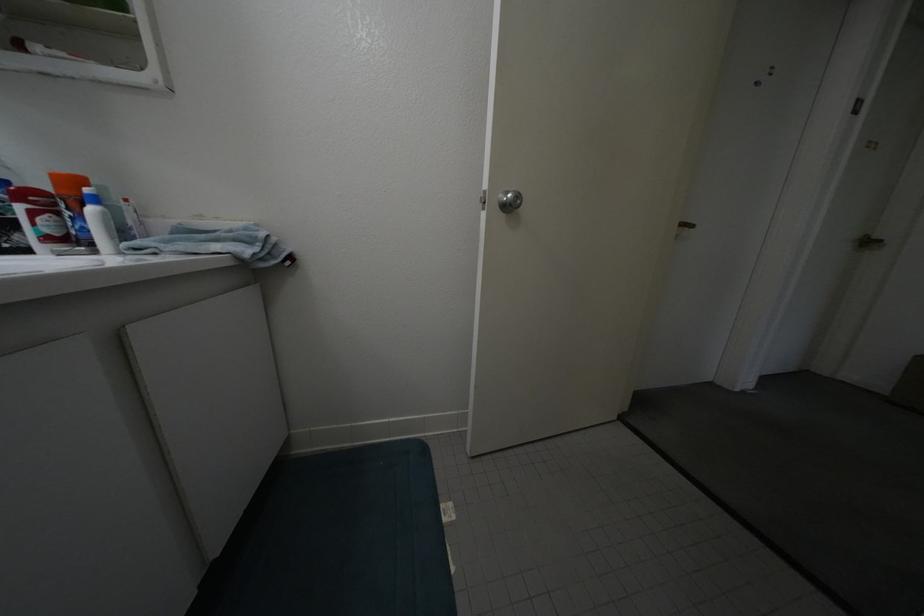
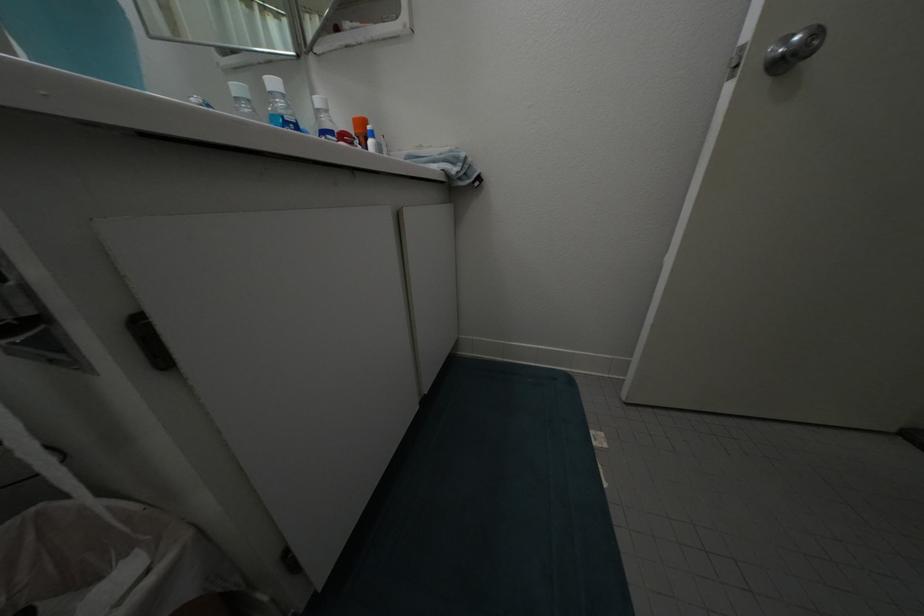
Question: How did the camera likely rotate?

Choices:
 (A) Left
 (B) Right
 (C) Up
 (D) Down

Answer: (A)